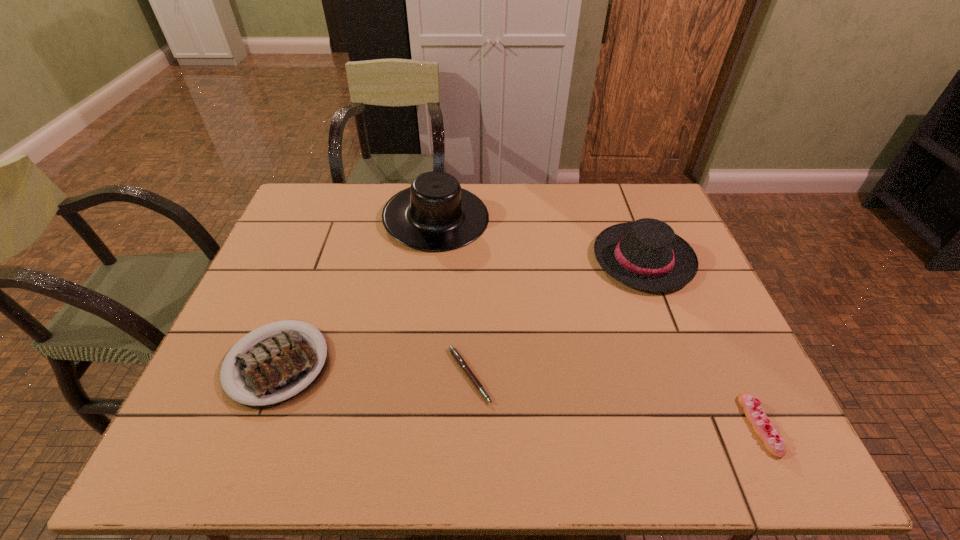
Where is `vacant region that satisfies the following two spatial constraints: 1. on the front side of the eclair; 2. on the right side of the fourth shortest object`? This screenshot has height=540, width=960. vacant region that satisfies the following two spatial constraints: 1. on the front side of the eclair; 2. on the right side of the fourth shortest object is located at coordinates (708, 426).